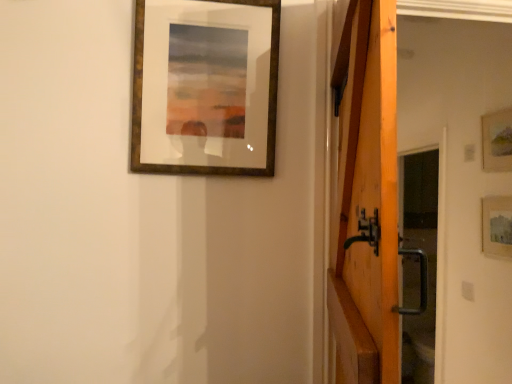
Question: Is wooden picture frame at upper right, which ranks as the 3th picture frame in left-to-right order, outside of wooden barn door at right?

Choices:
 (A) yes
 (B) no

Answer: (A)

Question: Is wooden picture frame at upper right, arranged as the second picture frame when viewed from the front, directly adjacent to wooden barn door at right?

Choices:
 (A) no
 (B) yes

Answer: (A)

Question: Could you tell me if wooden picture frame at upper right, which ranks as the 3th picture frame in left-to-right order, is facing wooden barn door at right?

Choices:
 (A) yes
 (B) no

Answer: (B)

Question: From a real-world perspective, is wooden picture frame at upper right, which ranks as the second picture frame in back-to-front order, under wooden barn door at right?

Choices:
 (A) yes
 (B) no

Answer: (B)

Question: Is the depth of wooden picture frame at upper right, arranged as the 1th picture frame when viewed from the right, greater than that of wooden barn door at right?

Choices:
 (A) yes
 (B) no

Answer: (A)

Question: Considering the relative sizes of wooden picture frame at upper right, which ranks as the 3th picture frame in left-to-right order, and wooden barn door at right in the image provided, is wooden picture frame at upper right, which ranks as the 3th picture frame in left-to-right order, thinner than wooden barn door at right?

Choices:
 (A) no
 (B) yes

Answer: (B)

Question: Is wooden frame at upper center, the 3th picture frame when ordered from right to left, thinner than wooden picture frame at upper right, arranged as the 1th picture frame when viewed from the right?

Choices:
 (A) no
 (B) yes

Answer: (A)

Question: Does wooden frame at upper center, which is the first picture frame in front-to-back order, contain wooden picture frame at upper right, which ranks as the 3th picture frame in left-to-right order?

Choices:
 (A) no
 (B) yes

Answer: (A)

Question: Does wooden frame at upper center, which is the third picture frame in back-to-front order, come in front of wooden picture frame at upper right, which ranks as the second picture frame in back-to-front order?

Choices:
 (A) yes
 (B) no

Answer: (A)

Question: From a real-world perspective, is wooden frame at upper center, which is the third picture frame in back-to-front order, on top of wooden picture frame at upper right, which ranks as the 3th picture frame in left-to-right order?

Choices:
 (A) no
 (B) yes

Answer: (B)

Question: Does wooden frame at upper center, placed as the first picture frame when sorted from left to right, lie behind wooden picture frame at upper right, arranged as the 1th picture frame when viewed from the right?

Choices:
 (A) no
 (B) yes

Answer: (A)

Question: Can you confirm if wooden frame at upper center, placed as the first picture frame when sorted from left to right, is positioned to the right of wooden picture frame at upper right, arranged as the second picture frame when viewed from the front?

Choices:
 (A) yes
 (B) no

Answer: (B)

Question: Is matte wooden picture frame at right, arranged as the second picture frame when viewed from the right, shorter than wooden barn door at right?

Choices:
 (A) no
 (B) yes

Answer: (B)